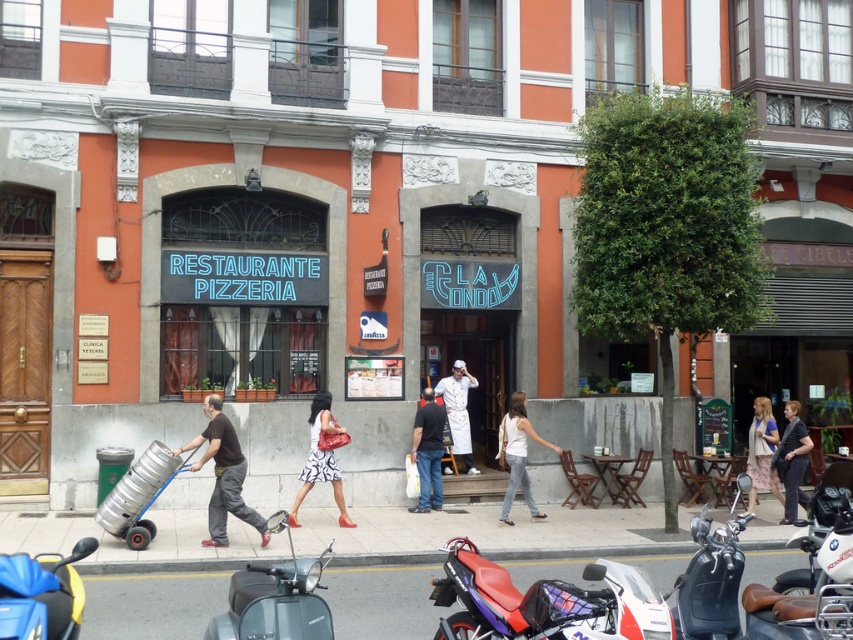
You are a pedestrian standing in front of the restaurant. You see a black matte motorcycle at lower right and dark blue jeans at center. Which object is closer to you?

The black matte motorcycle at lower right is closer to the viewer than the dark blue jeans at center.

You are a pedestrian standing in front of the restaurant. You see a metallic silver scooter at lower center and a white cotton tank top at center. Which object is closer to you?

The metallic silver scooter at lower center is closer to you because it is positioned over the white cotton tank top at center.